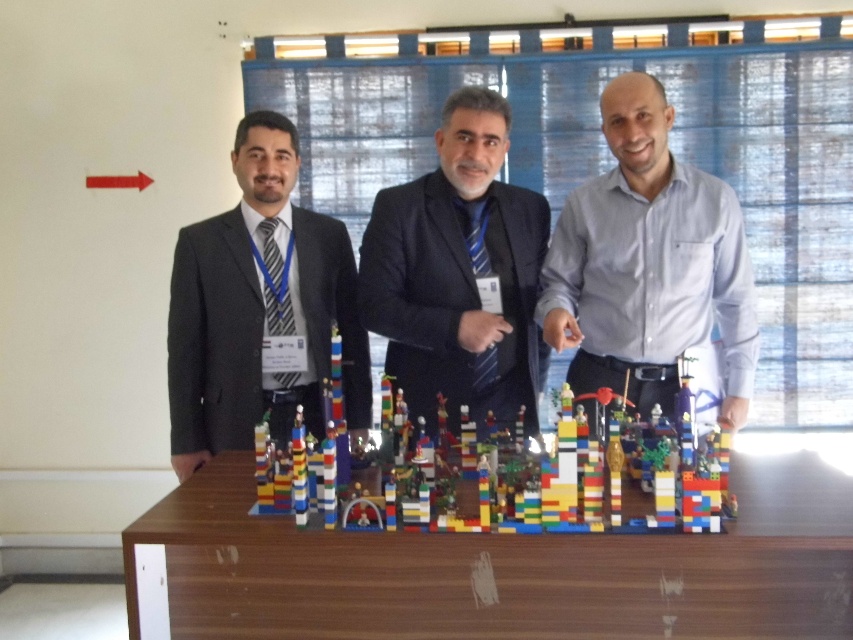
Question: Estimate the real-world distances between objects in this image. Which object is closer to the black matte suit at center?

Choices:
 (A) dark gray suit at left
 (B) multicolored plastic blocks at center
 (C) wooden table at center

Answer: (B)

Question: Which object appears closest to the camera in this image?

Choices:
 (A) light blue shirt at center
 (B) dark gray suit at left
 (C) multicolored plastic blocks at center
 (D) black matte suit at center

Answer: (C)

Question: Which point appears closest to the camera in this image?

Choices:
 (A) (374, 308)
 (B) (596, 332)

Answer: (A)

Question: Is multicolored plastic blocks at center in front of black matte suit at center?

Choices:
 (A) no
 (B) yes

Answer: (B)

Question: Where is dark gray suit at left located in relation to multicolored plastic blocks at center in the image?

Choices:
 (A) above
 (B) below

Answer: (A)

Question: Does light blue shirt at center have a lesser width compared to dark gray suit at left?

Choices:
 (A) yes
 (B) no

Answer: (B)